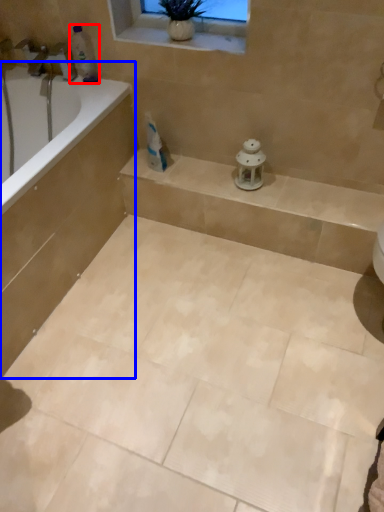
Question: Which point is further to the camera, toiletry (highlighted by a red box) or bath (highlighted by a blue box)?

Choices:
 (A) toiletry
 (B) bath

Answer: (A)